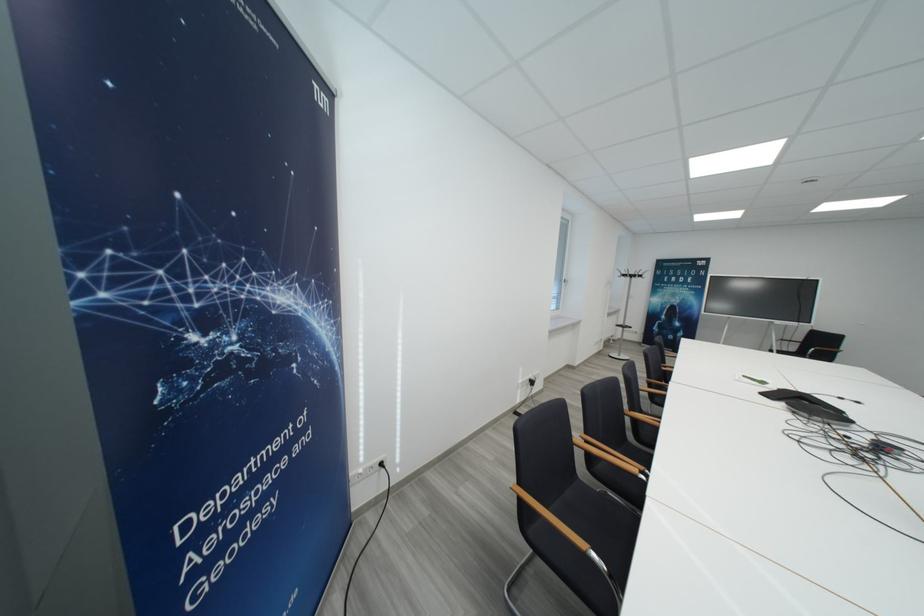
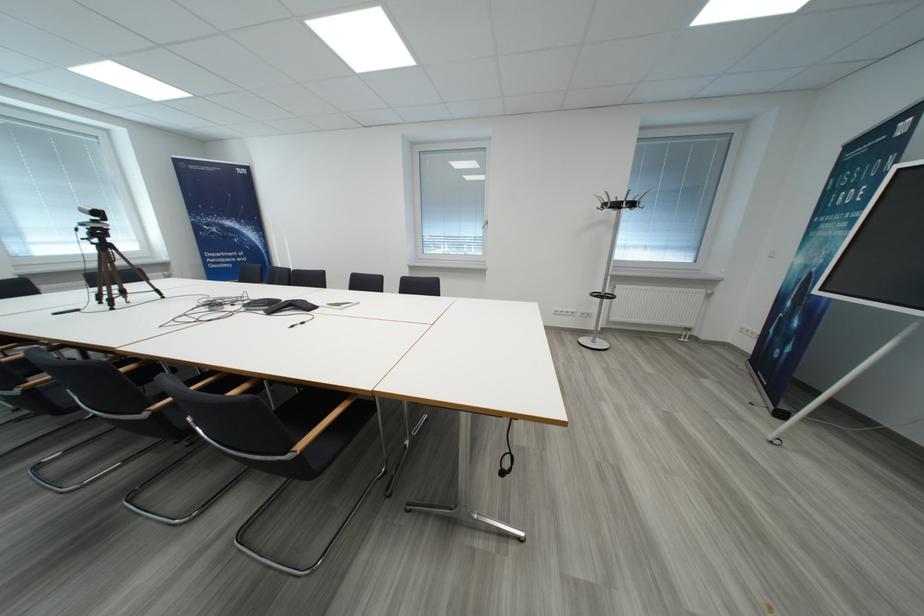
Where in the second image is the point corresponding to point 648,280 from the first image?

(623, 208)